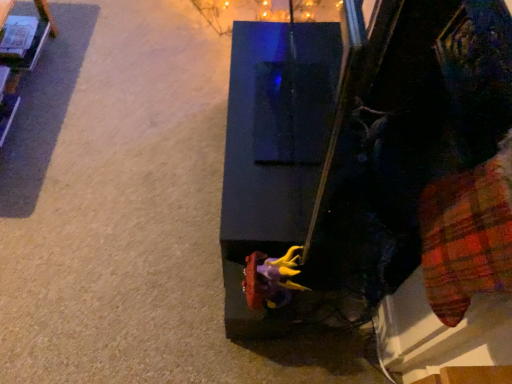
The width and height of the screenshot is (512, 384). What are the coordinates of `vacant area to the right of wooden bookshelf at upper left` in the screenshot? It's located at (124, 114).